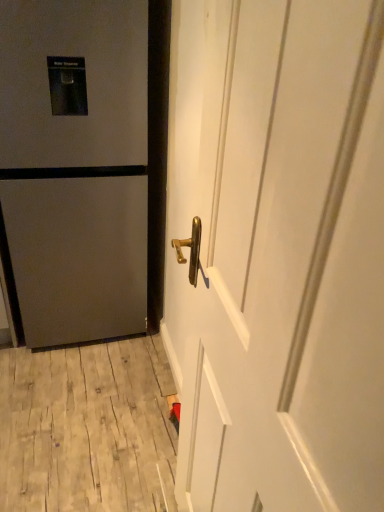
The width and height of the screenshot is (384, 512). I want to click on wooden at lower left, so click(x=87, y=428).

From a real-world perspective, which object rests below the other?

matte gray refrigerator at left, the second door positioned from the front.

In terms of width, does matte gray refrigerator at left, the first door viewed from the left, look wider or thinner when compared to white glossy door handle at center, acting as the second door starting from the back?

Clearly, matte gray refrigerator at left, the first door viewed from the left, has more width compared to white glossy door handle at center, acting as the second door starting from the back.

How distant is matte gray refrigerator at left, the first door viewed from the left, from white glossy door handle at center, which appears as the first door when viewed from the right?

They are 77.05 centimeters apart.

Is matte gray refrigerator at left, which is the 1th door in back-to-front order, in front of or behind white glossy door handle at center, acting as the second door starting from the back, in the image?

Visually, matte gray refrigerator at left, which is the 1th door in back-to-front order, is located behind white glossy door handle at center, acting as the second door starting from the back.

Who is taller, matte gray refrigerator at left, the 2th door from the right, or wooden at lower left?

With more height is matte gray refrigerator at left, the 2th door from the right.

Considering the relative sizes of matte gray refrigerator at left, the second door positioned from the front, and wooden at lower left in the image provided, is matte gray refrigerator at left, the second door positioned from the front, thinner than wooden at lower left?

Yes, matte gray refrigerator at left, the second door positioned from the front, is thinner than wooden at lower left.

From the image's perspective, is matte gray refrigerator at left, the second door positioned from the front, above or below wooden at lower left?

Based on their image positions, matte gray refrigerator at left, the second door positioned from the front, is located above wooden at lower left.

From the picture: Which is in front, matte gray refrigerator at left, the 2th door from the right, or wooden at lower left?

Positioned in front is matte gray refrigerator at left, the 2th door from the right.

Which is farther from the camera, (x=229, y=350) or (x=137, y=441)?

The point (x=137, y=441) is more distant.

Is white glossy door handle at center, which appears as the first door when viewed from the right, wider than wooden at lower left?

Incorrect, the width of white glossy door handle at center, which appears as the first door when viewed from the right, does not surpass that of wooden at lower left.

Is white glossy door handle at center, acting as the second door starting from the back, turned away from wooden at lower left?

No.

From a real-world perspective, which is physically below, white glossy door handle at center, which appears as the first door when viewed from the right, or wooden at lower left?

From a 3D spatial view, wooden at lower left is below.

Between white glossy door handle at center, placed as the 1th door when sorted from front to back, and matte gray refrigerator at left, which is the 1th door in back-to-front order, which one has smaller size?

white glossy door handle at center, placed as the 1th door when sorted from front to back, is smaller.

From the image's perspective, is white glossy door handle at center, placed as the 1th door when sorted from front to back, positioned above or below matte gray refrigerator at left, the second door positioned from the front?

white glossy door handle at center, placed as the 1th door when sorted from front to back, is below matte gray refrigerator at left, the second door positioned from the front.

Considering their positions, is white glossy door handle at center, which appears as the first door when viewed from the right, located in front of or behind matte gray refrigerator at left, which is the 1th door in back-to-front order?

white glossy door handle at center, which appears as the first door when viewed from the right, is positioned closer to the viewer than matte gray refrigerator at left, which is the 1th door in back-to-front order.

Is white glossy door handle at center, which appears as the first door when viewed from the right, inside the boundaries of matte gray refrigerator at left, the second door positioned from the front, or outside?

white glossy door handle at center, which appears as the first door when viewed from the right, is not enclosed by matte gray refrigerator at left, the second door positioned from the front.

From the image's perspective, between wooden at lower left and white glossy door handle at center, placed as the 1th door when sorted from front to back, which one is located above?

white glossy door handle at center, placed as the 1th door when sorted from front to back.

Is wooden at lower left next to white glossy door handle at center, which is counted as the 2th door, starting from the left?

They are not placed beside each other.

What's the angular difference between wooden at lower left and white glossy door handle at center, placed as the 1th door when sorted from front to back,'s facing directions?

wooden at lower left and white glossy door handle at center, placed as the 1th door when sorted from front to back, are facing 91.3 degrees away from each other.

Is wooden at lower left inside or outside of white glossy door handle at center, placed as the 1th door when sorted from front to back?

The correct answer is: outside.

Considering the relative sizes of wooden at lower left and matte gray refrigerator at left, the 2th door from the right, in the image provided, is wooden at lower left thinner than matte gray refrigerator at left, the 2th door from the right,?

Incorrect, the width of wooden at lower left is not less than that of matte gray refrigerator at left, the 2th door from the right.

Based on the photo, from a real-world perspective, which object stands above the other?

In real-world perspective, matte gray refrigerator at left, the first door viewed from the left, is above.

Image resolution: width=384 pixels, height=512 pixels. Identify the location of plywood that appears on the right of matte gray refrigerator at left, the second door positioned from the front. (87, 428).

Image resolution: width=384 pixels, height=512 pixels. I want to click on door behind the white glossy door handle at center, acting as the second door starting from the back, so click(85, 166).

In order to click on plywood below the matte gray refrigerator at left, the 2th door from the right (from the image's perspective) in this screenshot , I will do [x=87, y=428].

Which object lies nearer to the anchor point matte gray refrigerator at left, which is the 1th door in back-to-front order, white glossy door handle at center, which appears as the first door when viewed from the right, or wooden at lower left?

The object closer to matte gray refrigerator at left, which is the 1th door in back-to-front order, is wooden at lower left.

From the image, which object appears to be farther from white glossy door handle at center, which appears as the first door when viewed from the right, wooden at lower left or matte gray refrigerator at left, which is the 1th door in back-to-front order?

Based on the image, wooden at lower left appears to be further to white glossy door handle at center, which appears as the first door when viewed from the right.

Which object lies further to the anchor point white glossy door handle at center, placed as the 1th door when sorted from front to back, matte gray refrigerator at left, the first door viewed from the left, or wooden at lower left?

Based on the image, wooden at lower left appears to be further to white glossy door handle at center, placed as the 1th door when sorted from front to back.

From the image, which object appears to be nearer to matte gray refrigerator at left, which is the 1th door in back-to-front order, wooden at lower left or white glossy door handle at center, which is counted as the 2th door, starting from the left?

wooden at lower left is positioned closer to the anchor matte gray refrigerator at left, which is the 1th door in back-to-front order.

From the image, which object appears to be nearer to wooden at lower left, matte gray refrigerator at left, the second door positioned from the front, or white glossy door handle at center, which is counted as the 2th door, starting from the left?

matte gray refrigerator at left, the second door positioned from the front.

Based on their spatial positions, is white glossy door handle at center, which appears as the first door when viewed from the right, or matte gray refrigerator at left, the 2th door from the right, further from wooden at lower left?

white glossy door handle at center, which appears as the first door when viewed from the right.

Find the location of a particular element. door located between white glossy door handle at center, which appears as the first door when viewed from the right, and wooden at lower left in the depth direction is located at coordinates (85, 166).